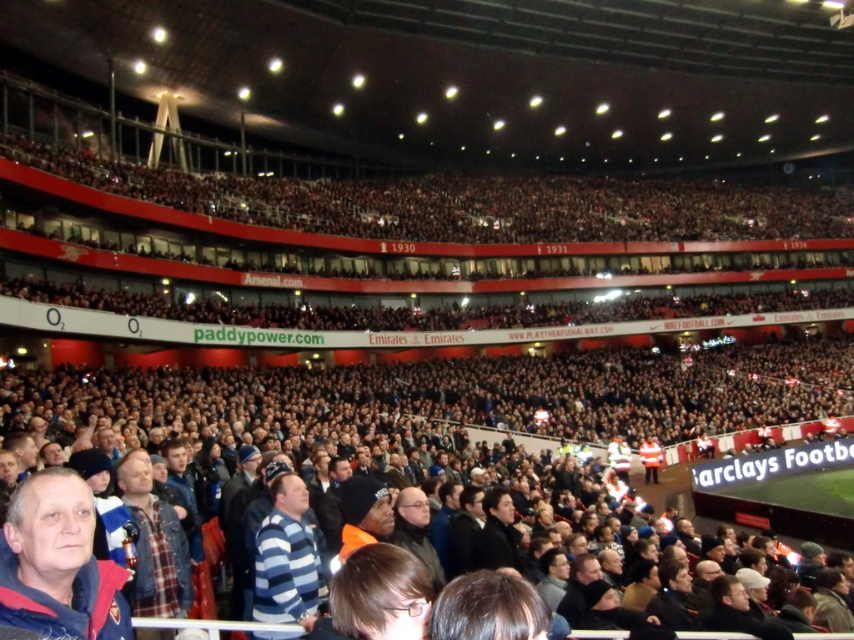
You are a photographer standing at point (287, 557) in the stadium. You want to capture a photo of the striped cotton shirt at center. Is the striped cotton shirt at center visible from your current position?

The striped cotton shirt at center is located at point (287, 557), so yes, it is directly in front of you and visible from your current position.

You are a photographer standing at the center of the stadium. You want to take a photo that includes both the point at coordinates point (x=256, y=570) and point (x=496, y=518). Which point will appear larger in your photo?

Point (x=256, y=570) will appear larger in the photo because it is closer to the camera than point (x=496, y=518).